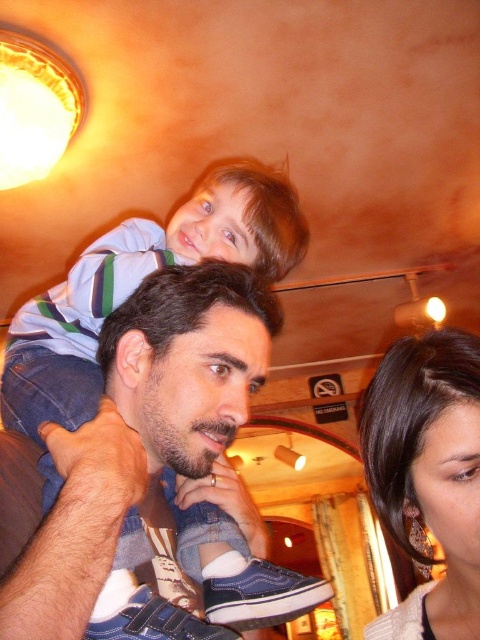
Based on the photo, you are a photographer trying to capture the scene in the image. You want to ensure that both the dark brown hair at center and the satin brown hair at upper right are clearly visible in your photo. Based on their positions, which hair is closer to the left edge of the frame?

The dark brown hair at center is positioned on the left side of satin brown hair at upper right, so the dark brown hair at center is closer to the left edge of the frame.

You are a photographer trying to capture both the dark brown hair at center and the satin brown hair at upper right in a single frame. Based on their sizes, which one would appear bigger in your photo?

The dark brown hair at center would appear bigger in the photo because it has a larger size compared to the satin brown hair at upper right.

You are standing in the restaurant and want to take a photo of the dark brown hair at center. Where should you position yourself to capture it in the frame?

To capture the dark brown hair at center in the frame, position yourself so that the camera is aimed at the coordinates point (189, 358).